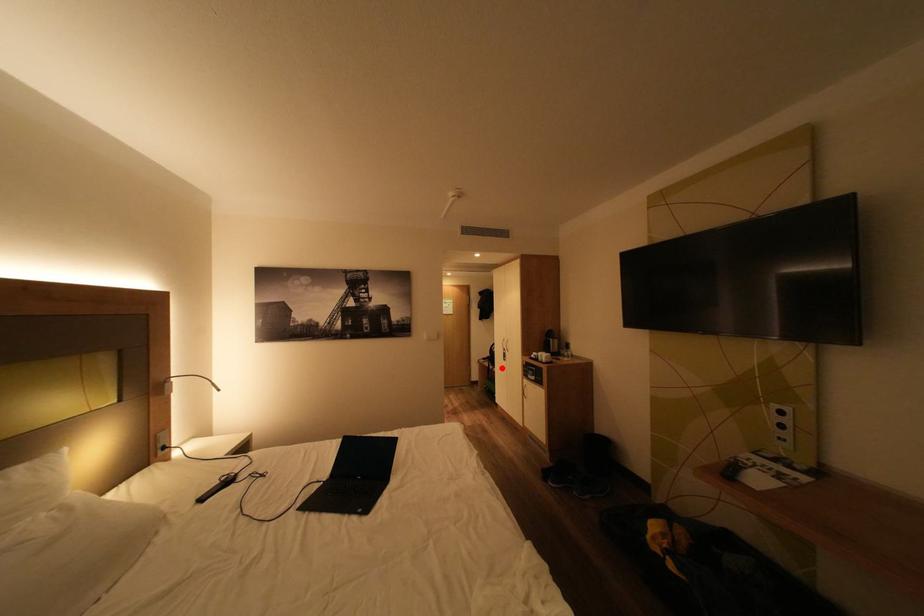
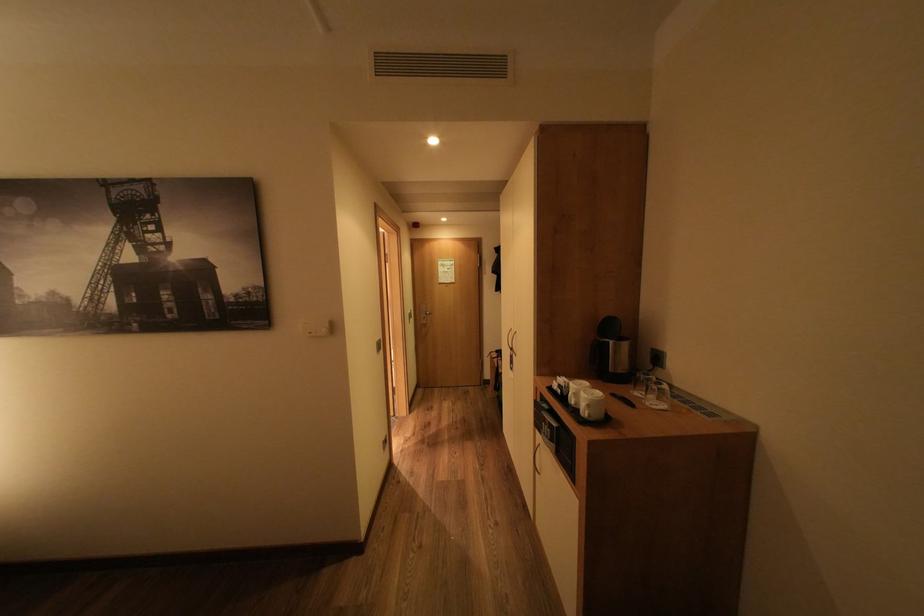
Question: A red point is marked in image1. In image2, is the corresponding 3D point closer to the camera or farther? Reply with the corresponding letter.

Choices:
 (A) The corresponding 3D point is closer.
 (B) The corresponding 3D point is farther.

Answer: (A)